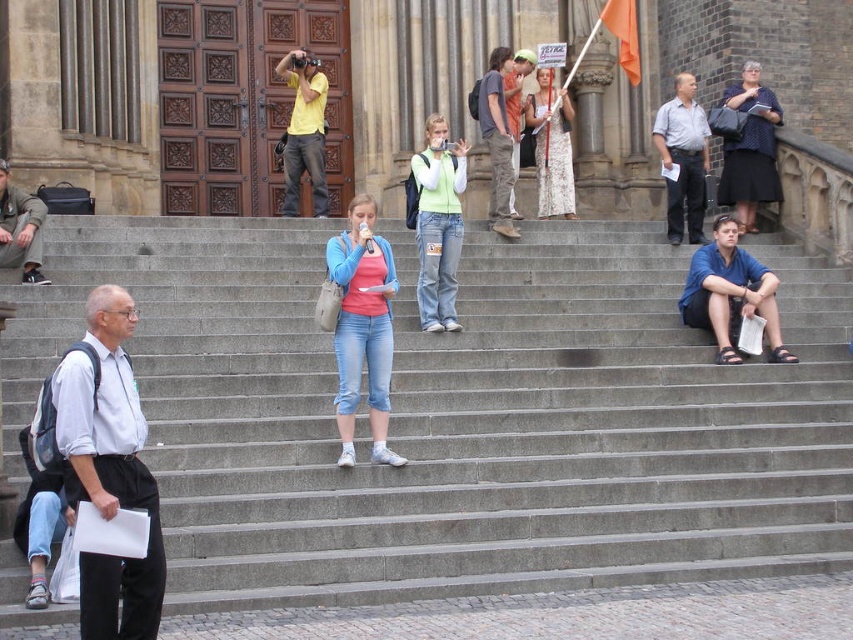
Question: Among these points, which one is nearest to the camera?

Choices:
 (A) (666, 141)
 (B) (515, 216)

Answer: (B)

Question: Which object appears farthest from the camera in this image?

Choices:
 (A) white shirt at left
 (B) camouflage pants at center
 (C) matte gray jacket at lower left
 (D) light green sweater at center

Answer: (B)

Question: Is blue cotton shirt at right thinner than white lace dress at center?

Choices:
 (A) no
 (B) yes

Answer: (A)

Question: Is white lace dress at center below camouflage pants at center?

Choices:
 (A) no
 (B) yes

Answer: (A)

Question: Can you confirm if blue cotton shirt at right is smaller than camouflage pants at center?

Choices:
 (A) no
 (B) yes

Answer: (B)

Question: Which object is the closest to the light green sweater at center?

Choices:
 (A) light gray shirt at upper right
 (B) pink fabric shirt at center
 (C) white lace dress at center
 (D) blue cotton shirt at right

Answer: (D)